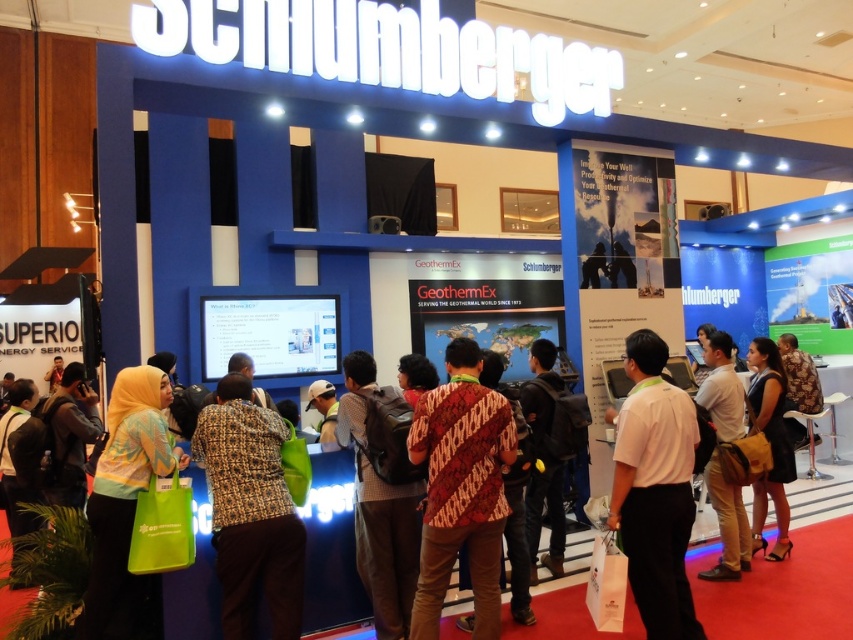
You are a photographer at the exhibition and want to ensure both the tan fabric shirt at center and the black leather dress at center are visible in your photo. Since you can only focus on one item, which one should you choose to ensure the other remains in the background without being too blurry?

The tan fabric shirt at center is thinner than the black leather dress at center, so focusing on the black leather dress at center would keep the tan fabric shirt at center in a less blurry background.

You are at the trade show and want to take a photo of the tan fabric shirt at center. You have a camera with a maximum focus range of 12 feet. Can you take the photo without moving closer?

The tan fabric shirt at center and camera are 13.04 feet apart, which exceeds the camera maximum focus range of 12 feet. Therefore, you cannot take the photo without moving closer.